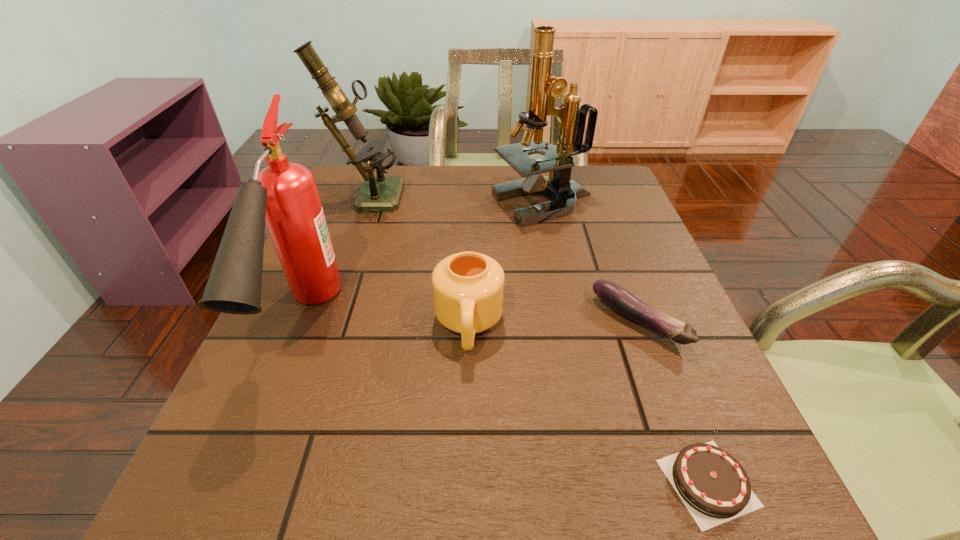
Locate an element on the screen. The width and height of the screenshot is (960, 540). the right microscope is located at coordinates (544, 87).

This screenshot has width=960, height=540. Find the location of `the left microscope`. the left microscope is located at coordinates (382, 193).

You are a GUI agent. You are given a task and a screenshot of the screen. Output one action in this format:
    pyautogui.click(x=<x>, y=<y>)
    Task: Click on the fire extinguisher
    The width and height of the screenshot is (960, 540).
    Given the screenshot: What is the action you would take?
    pyautogui.click(x=284, y=195)

Where is `mug`? mug is located at coordinates (468, 288).

Where is `eggplant`? The image size is (960, 540). eggplant is located at coordinates (616, 297).

Locate an element on the screen. The height and width of the screenshot is (540, 960). chocolate cake is located at coordinates (715, 488).

At what (x,y) coordinates should I click in order to perform the action: click on the shortest object. Please return your answer as a coordinate pair (x, y). The image size is (960, 540). Looking at the image, I should click on (715, 488).

What are the coordinates of `vacant space located 0.380m at the eyepiece of the right microscope` in the screenshot? It's located at (344, 204).

The image size is (960, 540). In order to click on free space located 0.090m at the eyepiece of the right microscope in this screenshot , I will do `click(457, 204)`.

In order to click on blank space located at the eyepiece of the right microscope in this screenshot , I will do `click(402, 204)`.